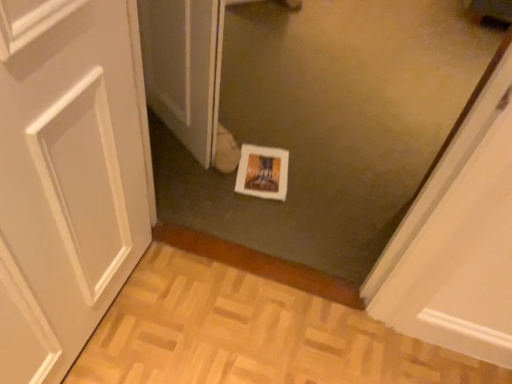
This screenshot has height=384, width=512. Identify the location of vacant space to the right of white glossy screen door at center. 263,140.